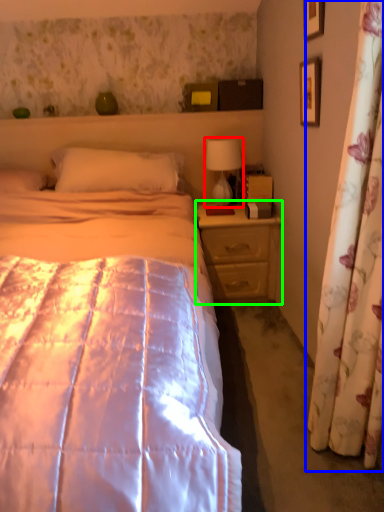
Question: Which object is positioned farthest from table lamp (highlighted by a red box)? Select from curtain (highlighted by a blue box) and nightstand (highlighted by a green box).

Choices:
 (A) curtain
 (B) nightstand

Answer: (A)